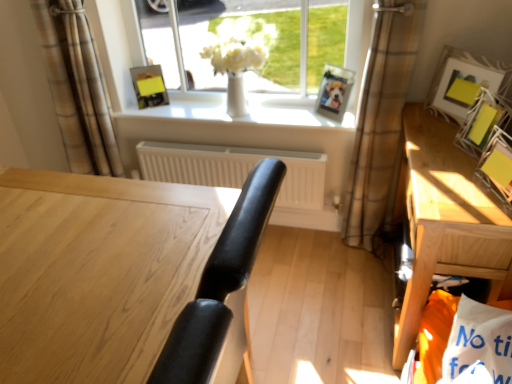
Question: Considering the relative sizes of yellow paper at upper right, the first picture frame positioned from the right, and wooden table at right in the image provided, is yellow paper at upper right, the first picture frame positioned from the right, bigger than wooden table at right?

Choices:
 (A) yes
 (B) no

Answer: (B)

Question: Considering the relative sizes of yellow paper at upper right, the 1th picture frame from the front, and wooden table at right in the image provided, is yellow paper at upper right, the 1th picture frame from the front, taller than wooden table at right?

Choices:
 (A) no
 (B) yes

Answer: (A)

Question: Does yellow paper at upper right, the fifth picture frame viewed from the left, have a lesser width compared to wooden table at right?

Choices:
 (A) no
 (B) yes

Answer: (B)

Question: Is yellow paper at upper right, which is counted as the fifth picture frame, starting from the back, to the right of wooden table at right from the viewer's perspective?

Choices:
 (A) no
 (B) yes

Answer: (B)

Question: Is yellow paper at upper right, the fifth picture frame viewed from the left, beside wooden table at right?

Choices:
 (A) yes
 (B) no

Answer: (B)

Question: Looking at their shapes, would you say white matte radiator at center is wider or thinner than brown plaid curtain at upper left, which is counted as the 2th curtain, starting from the right?

Choices:
 (A) thin
 (B) wide

Answer: (A)

Question: Does point (204, 148) appear closer or farther from the camera than point (59, 99)?

Choices:
 (A) closer
 (B) farther

Answer: (B)

Question: From the image's perspective, is white matte radiator at center positioned above or below brown plaid curtain at upper left, marked as the first curtain in a left-to-right arrangement?

Choices:
 (A) below
 (B) above

Answer: (A)

Question: Which is correct: white matte radiator at center is inside brown plaid curtain at upper left, marked as the first curtain in a left-to-right arrangement, or outside of it?

Choices:
 (A) outside
 (B) inside

Answer: (A)

Question: Is white matte radiator at center in front of or behind matte yellow picture frame at upper center, which appears as the first picture frame when viewed from the left, in the image?

Choices:
 (A) behind
 (B) front

Answer: (B)

Question: Choose the correct answer: Is white matte radiator at center inside matte yellow picture frame at upper center, which appears as the first picture frame when viewed from the left, or outside it?

Choices:
 (A) outside
 (B) inside

Answer: (A)

Question: Is point (258, 152) positioned closer to the camera than point (160, 69)?

Choices:
 (A) farther
 (B) closer

Answer: (B)

Question: From a real-world perspective, is white matte radiator at center positioned above or below matte yellow picture frame at upper center, positioned as the fifth picture frame in right-to-left order?

Choices:
 (A) above
 (B) below

Answer: (B)

Question: Is point (126, 38) closer or farther from the camera than point (473, 137)?

Choices:
 (A) farther
 (B) closer

Answer: (A)

Question: Considering the positions of white glossy vase at center and matte yellow picture frame at right, the 2th picture frame when ordered from right to left, in the image, is white glossy vase at center taller or shorter than matte yellow picture frame at right, the 2th picture frame when ordered from right to left,?

Choices:
 (A) short
 (B) tall

Answer: (B)